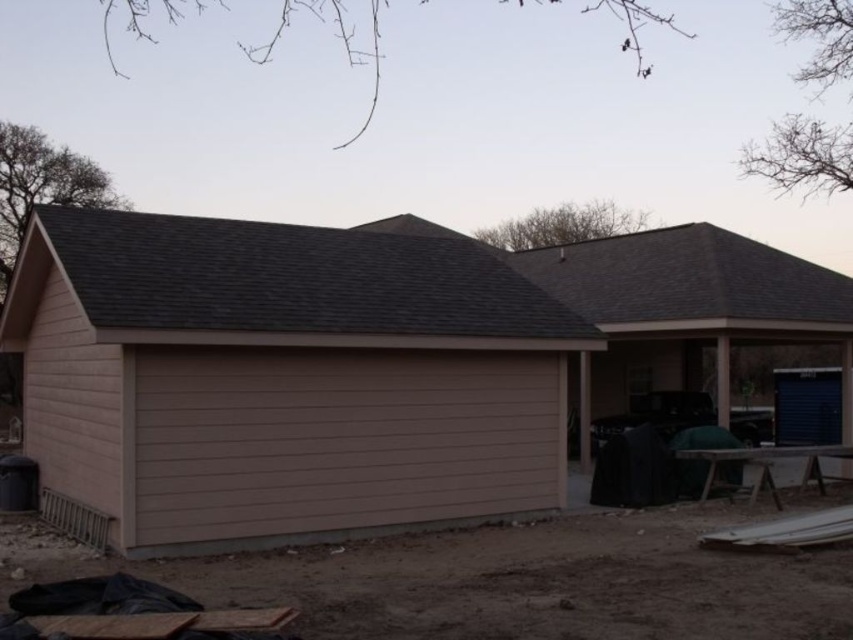
Question: Is beige siding garage at center smaller than gray shingles at upper center?

Choices:
 (A) no
 (B) yes

Answer: (A)

Question: Does beige siding garage at center have a smaller size compared to gray shingles at upper center?

Choices:
 (A) no
 (B) yes

Answer: (A)

Question: Which object is closer to the camera taking this photo?

Choices:
 (A) gray shingles at upper center
 (B) beige siding garage at center

Answer: (B)

Question: Does beige siding garage at center have a smaller size compared to gray shingles at upper center?

Choices:
 (A) no
 (B) yes

Answer: (A)